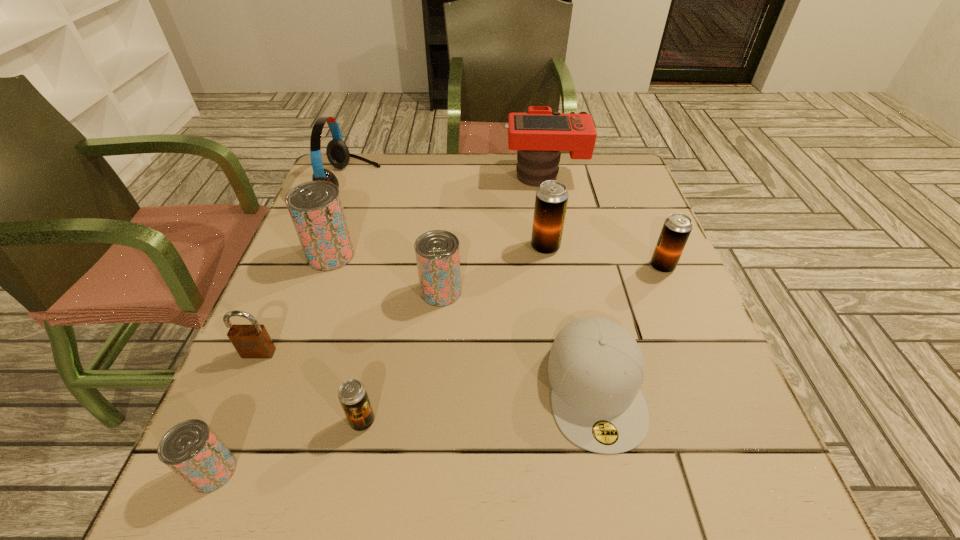
Where is `vacant point located between the smallest red beer can and the second black beer can from left to right`? vacant point located between the smallest red beer can and the second black beer can from left to right is located at coordinates (379, 359).

You are a GUI agent. You are given a task and a screenshot of the screen. Output one action in this format:
    pyautogui.click(x=<x>, y=<y>)
    Task: Click on the free space between the rightmost object and the farthest red beer can
    The image size is (960, 540).
    Given the screenshot: What is the action you would take?
    pyautogui.click(x=496, y=261)

Locate an element on the screen. This screenshot has height=540, width=960. the seventh closest object relative to the nearest red beer can is located at coordinates (551, 200).

You are a GUI agent. You are given a task and a screenshot of the screen. Output one action in this format:
    pyautogui.click(x=<x>, y=<y>)
    Task: Click on the sixth closest object to the fifth object from right to left
    Image resolution: width=960 pixels, height=540 pixels.
    Given the screenshot: What is the action you would take?
    pyautogui.click(x=337, y=152)

Select which beer can is the fifth closest to the headset. Please provide its 2D coordinates. Your answer should be formatted as a tuple, i.e. [(x, y)], where the tuple contains the x and y coordinates of a point satisfying the conditions above.

[(190, 449)]

Where is `beer can that stands as the fourth closest to the rightmost beer can`? The image size is (960, 540). beer can that stands as the fourth closest to the rightmost beer can is located at coordinates (315, 207).

At what (x,y) coordinates should I click in order to perform the action: click on black beer can that is the third closest one to the camera. Please return your answer as a coordinate pair (x, y). This screenshot has width=960, height=540. Looking at the image, I should click on (352, 394).

The width and height of the screenshot is (960, 540). Find the location of `black beer can that is the closest to the rightmost black beer can`. black beer can that is the closest to the rightmost black beer can is located at coordinates (551, 200).

What are the coordinates of `red beer can that can be found as the second closest to the headset` in the screenshot? It's located at (437, 252).

Locate an element on the screen. This screenshot has height=540, width=960. red beer can that is the second closest to the camera is located at coordinates (315, 207).